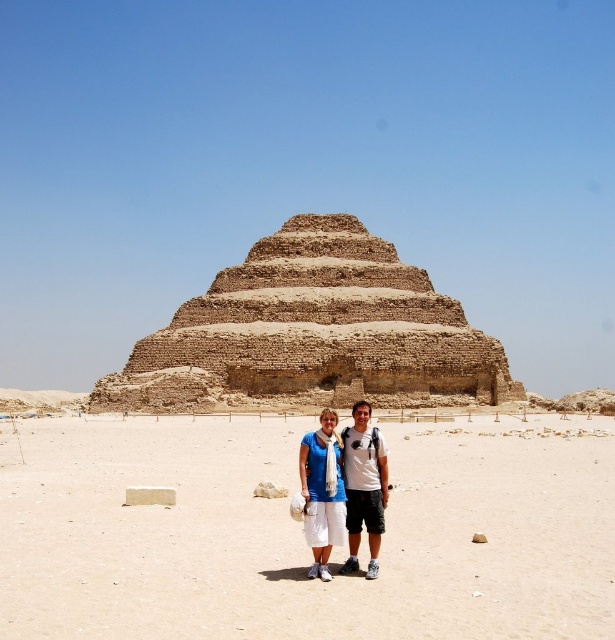
Question: Where is blue cotton shirt at center located in relation to matte blue shirt at center in the image?

Choices:
 (A) above
 (B) below

Answer: (A)

Question: Where is beige sandy ground at center located in relation to blue cotton shirt at center in the image?

Choices:
 (A) left
 (B) right

Answer: (B)

Question: Estimate the real-world distances between objects in this image. Which object is farther from the beige sandy ground at center?

Choices:
 (A) blue cotton shirt at center
 (B) brown stone pyramid at center
 (C) matte blue shirt at center

Answer: (B)

Question: Which point is farther to the camera?

Choices:
 (A) blue cotton shirt at center
 (B) matte blue shirt at center

Answer: (B)

Question: Does brown stone pyramid at center come in front of blue cotton shirt at center?

Choices:
 (A) no
 (B) yes

Answer: (A)

Question: Which is farther from the blue cotton shirt at center?

Choices:
 (A) beige sandy ground at center
 (B) brown stone pyramid at center

Answer: (B)